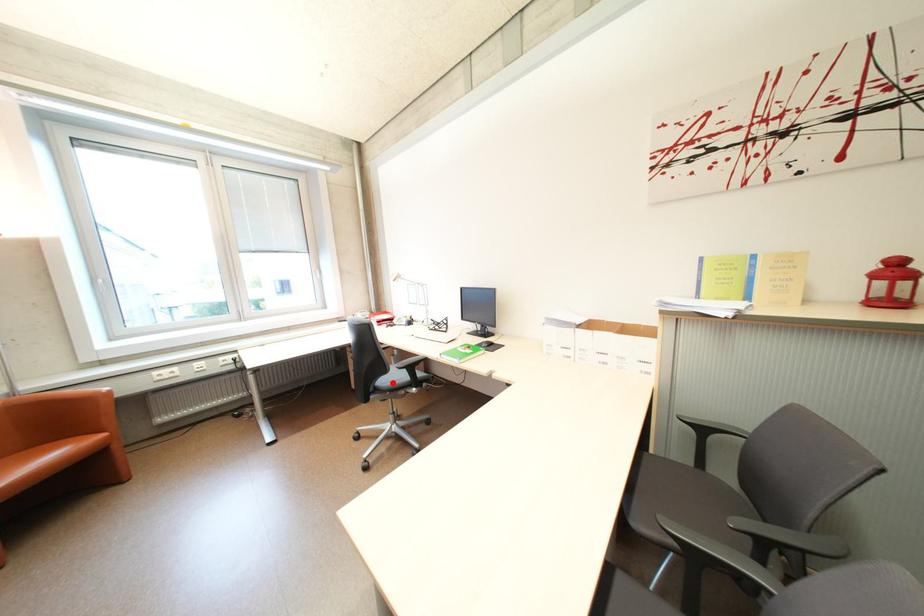
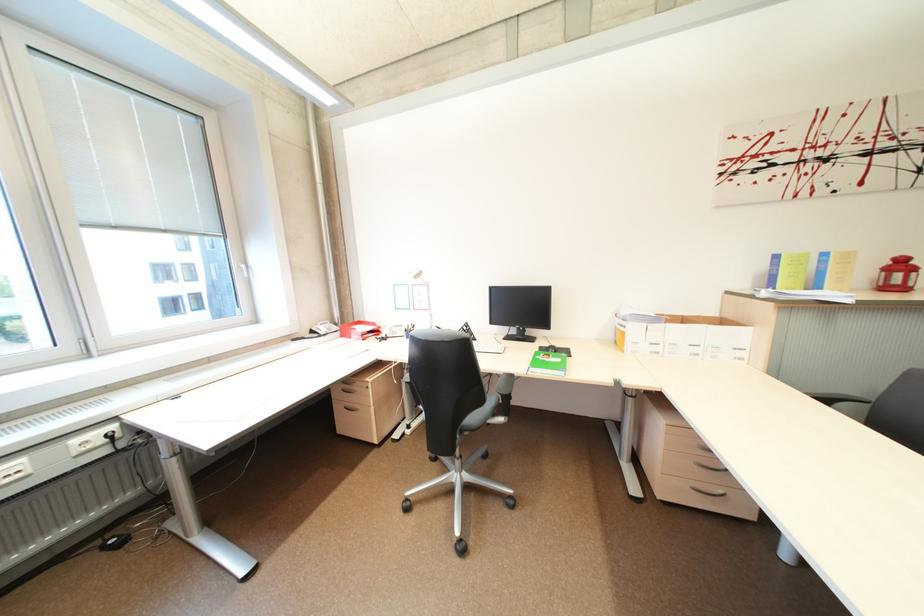
The point at the highlighted location is marked in the first image. Where is the corresponding point in the second image?

(482, 419)